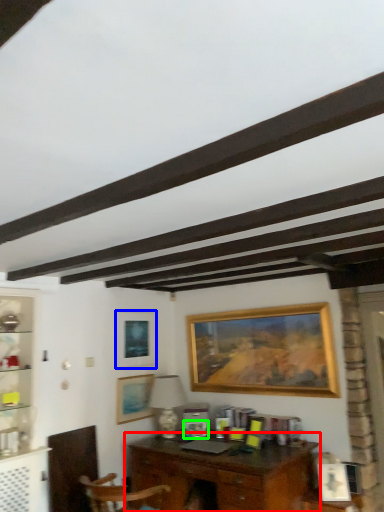
Question: Which object is the farthest from desk (highlighted by a red box)? Choose among these: picture frame (highlighted by a blue box) or picture frame (highlighted by a green box).

Choices:
 (A) picture frame
 (B) picture frame

Answer: (A)